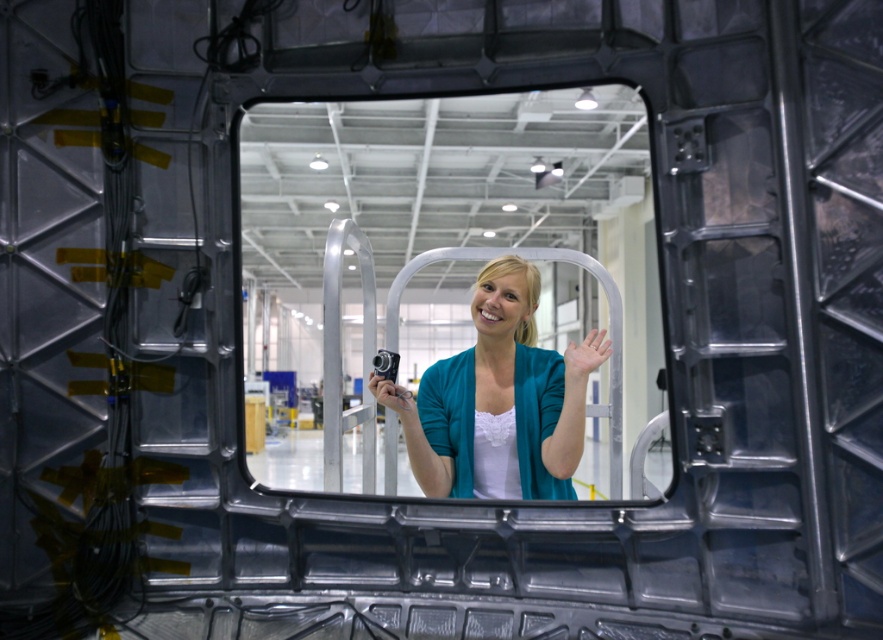
You are an inspector in the facility and need to confirm the visibility of the equipment through the metallic grid. Since the teal fabric jacket at center and the matte skin hand at center are in your line of sight, which one is blocking more of the view?

The teal fabric jacket at center is above the matte skin hand at center, so it is blocking more of the view.

You are a photographer positioned at the camera location. You want to take a closeup shot of the clear glass mirror at center. Considering your current position, can you move closer to the mirror to capture more detail?

The clear glass mirror at center is 2.53 meters away from the camera. Since you are at the camera location, you can move closer to the mirror to reduce the distance and capture more detail in your photo.

You are standing in front of the metallic structure and want to take a photo of both the clear glass mirror at center and the teal fabric jacket at center through the opening. Can you fit both objects in the frame of your camera without moving your position?

The clear glass mirror at center and the teal fabric jacket at center are 30.47 feet apart. Since the distance between them is quite large, it might be challenging to fit both in the camera frame from your current position without moving.